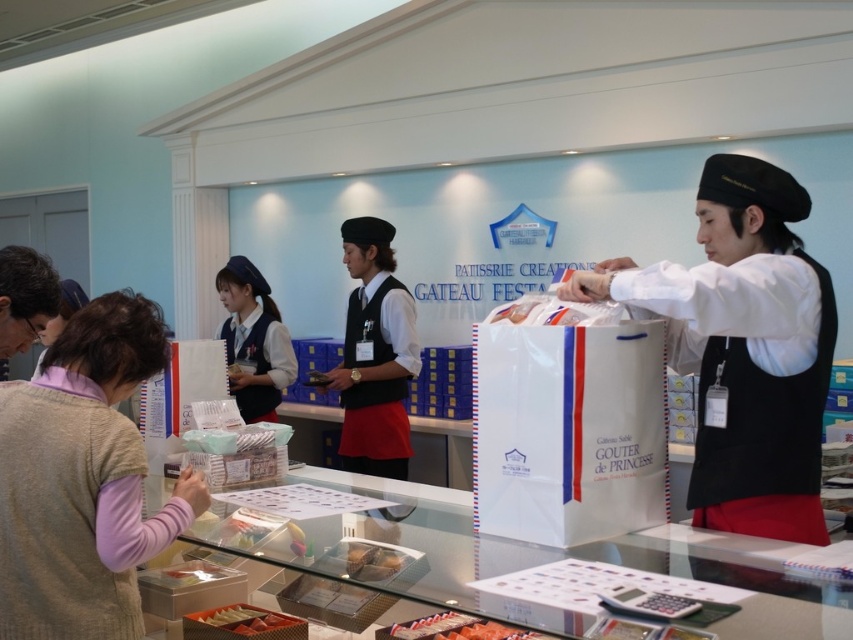
Question: Does knitted beige vest at lower left lie in front of matte white uniform at center?

Choices:
 (A) yes
 (B) no

Answer: (A)

Question: Does matte white uniform at center appear on the left side of smooth chocolate bar at lower left?

Choices:
 (A) no
 (B) yes

Answer: (B)

Question: Which of the following is the farthest from the observer?

Choices:
 (A) (79, 545)
 (B) (283, 628)

Answer: (B)

Question: Considering the relative positions of smooth chocolate bar at lower left and matte brown chocolate bar at center in the image provided, where is smooth chocolate bar at lower left located with respect to matte brown chocolate bar at center?

Choices:
 (A) right
 (B) left

Answer: (B)

Question: Among these points, which one is farthest from the camera?

Choices:
 (A) (86, 406)
 (B) (229, 372)
 (C) (387, 563)
 (D) (202, 632)

Answer: (B)

Question: Which point appears farthest from the camera in this image?

Choices:
 (A) (229, 612)
 (B) (386, 554)

Answer: (A)